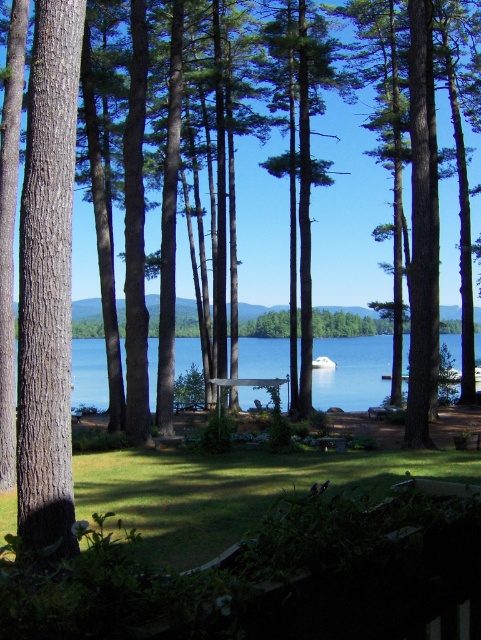
Is blue water at center wider than wooden picnic table at center?

Yes.

Does blue water at center appear on the right side of wooden picnic table at center?

Yes, blue water at center is to the right of wooden picnic table at center.

Is point (266, 353) closer to camera compared to point (289, 394)?

No.

The image size is (481, 640). In order to click on blue water at center in this screenshot , I will do `click(353, 372)`.